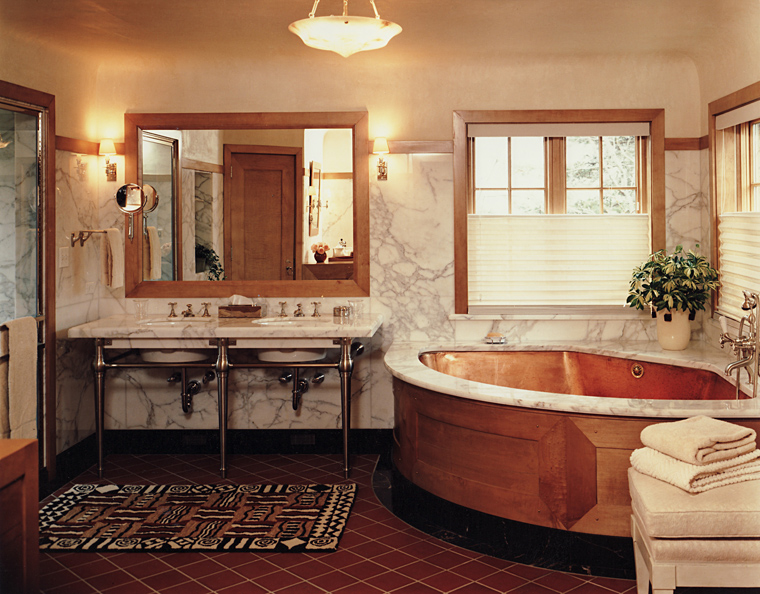
Where is `the top towel`? The width and height of the screenshot is (760, 594). the top towel is located at coordinates (698, 439).